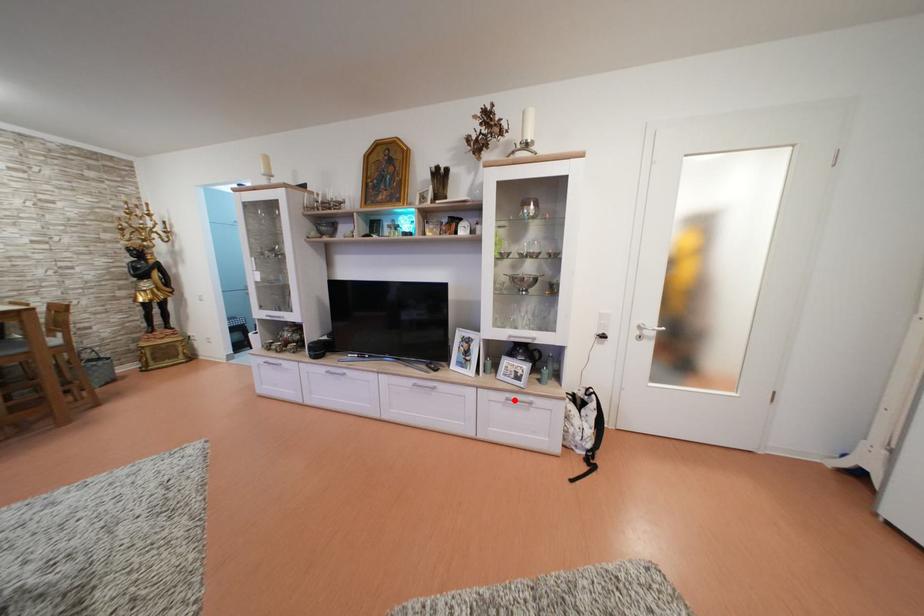
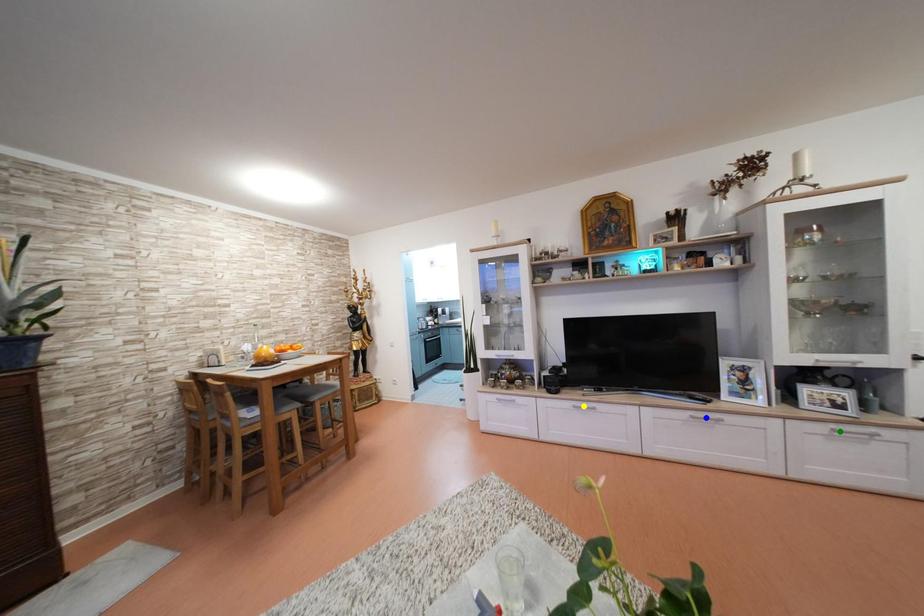
Question: I am providing you with two images of the same scene from different viewpoints. A red point is marked on the first image. You are given multiple points on the second image. Which spot in image 2 lines up with the point in image 1?

Choices:
 (A) blue point
 (B) yellow point
 (C) green point

Answer: (C)